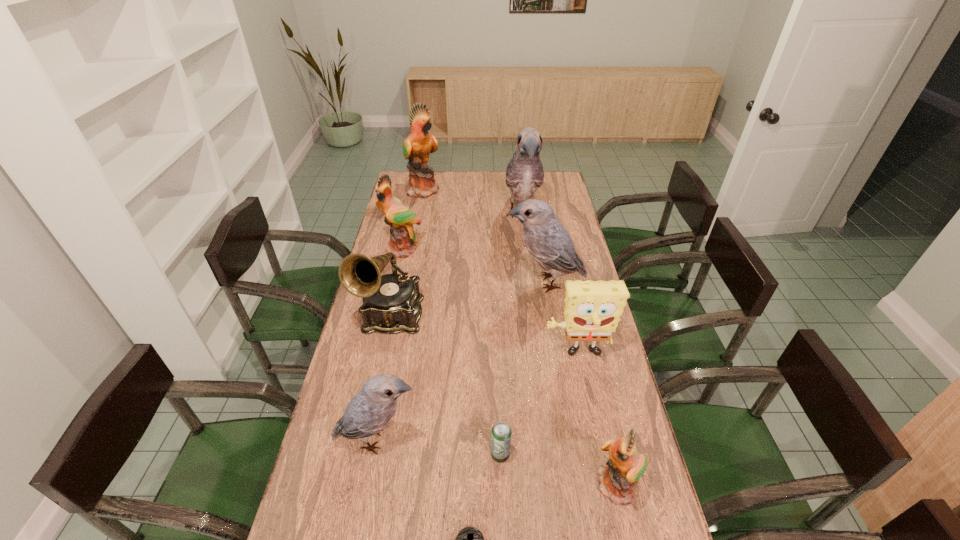
The width and height of the screenshot is (960, 540). Identify the location of the biggest green parrot. (417, 147).

Find the location of `the farthest gray parrot`. the farthest gray parrot is located at coordinates (524, 174).

Locate an element on the screen. This screenshot has width=960, height=540. the second nearest green parrot is located at coordinates (402, 241).

Locate an element on the screen. The height and width of the screenshot is (540, 960). the second nearest gray parrot is located at coordinates (549, 244).

This screenshot has width=960, height=540. In order to click on the second smallest gray parrot in this screenshot , I will do `click(549, 244)`.

What are the coordinates of `phonograph record` in the screenshot? It's located at (391, 304).

The image size is (960, 540). What are the coordinates of `sponge` in the screenshot? It's located at (592, 309).

This screenshot has height=540, width=960. I want to click on the smallest gray parrot, so click(371, 410).

Locate an element on the screen. The image size is (960, 540). the second nearest parrot is located at coordinates (371, 410).

The height and width of the screenshot is (540, 960). I want to click on the nearest green parrot, so click(x=626, y=465).